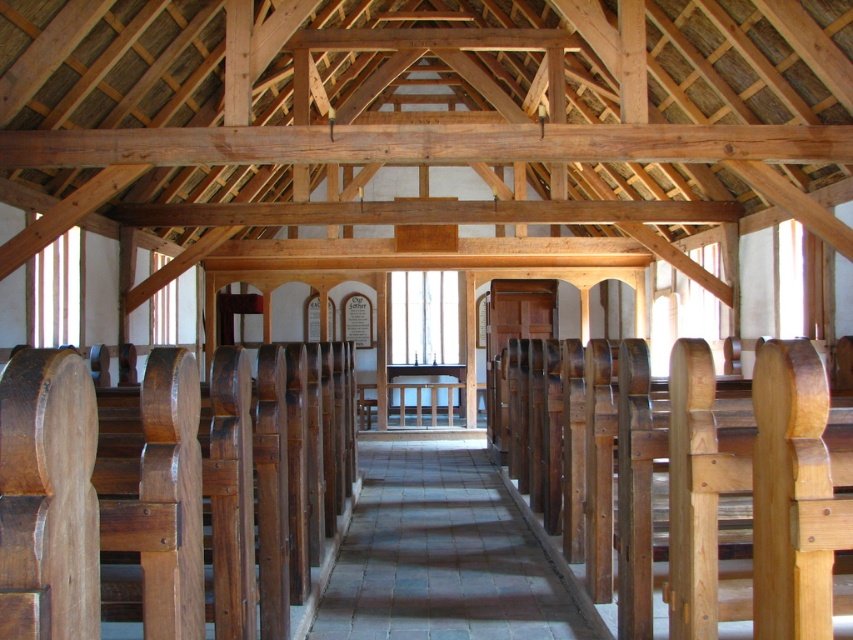
Between natural wood church bench at center and gray stone aisle at center, which one is positioned higher?

Positioned higher is natural wood church bench at center.

Locate an element on the screen. This screenshot has width=853, height=640. natural wood church bench at center is located at coordinates (740, 483).

Is point (628, 371) more distant than point (473, 596)?

That is False.

This screenshot has height=640, width=853. In order to click on natural wood church bench at center in this screenshot , I will do `click(740, 483)`.